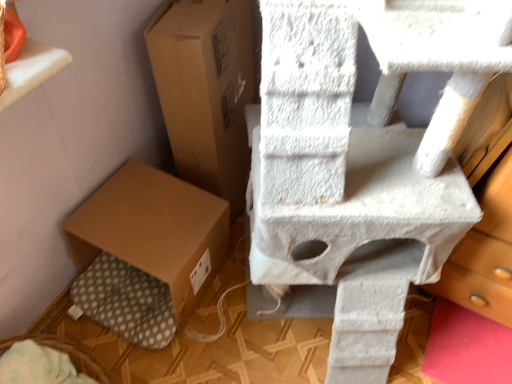
Identify the location of free space above brown cardboard box at lower left, arranged as the first cardboard box when ordered from the bottom (from a real-world perspective). The width and height of the screenshot is (512, 384). (143, 217).